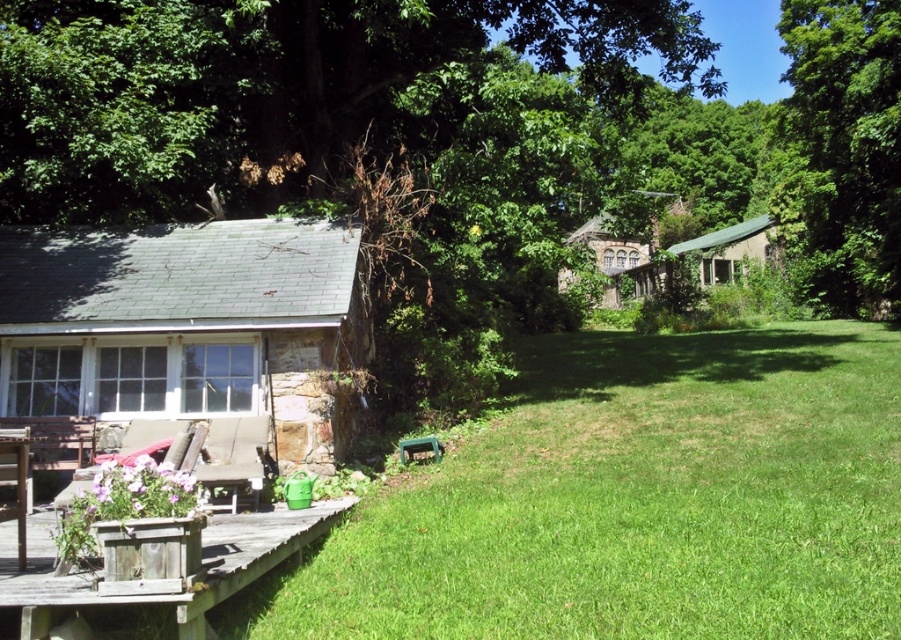
Question: Among these points, which one is farthest from the camera?

Choices:
 (A) (727, 237)
 (B) (1, 598)
 (C) (629, 241)
 (D) (8, 515)

Answer: (C)

Question: Is white stone cottage at left thinner than wooden picnic table at lower left?

Choices:
 (A) yes
 (B) no

Answer: (B)

Question: Which object is positioned farthest from the rustic stone cottage at center?

Choices:
 (A) green leafy tree at upper right
 (B) green corrugated metal cottage at center-right
 (C) green grass at lower center

Answer: (C)

Question: Can you confirm if green grass at lower center is smaller than green corrugated metal cottage at center-right?

Choices:
 (A) yes
 (B) no

Answer: (A)

Question: Considering the relative positions of green grass at lower center and weathered wood deck at lower left in the image provided, where is green grass at lower center located with respect to weathered wood deck at lower left?

Choices:
 (A) right
 (B) left

Answer: (A)

Question: Which point appears farthest from the camera in this image?

Choices:
 (A) (890, 364)
 (B) (317, 513)
 (C) (729, 266)

Answer: (C)